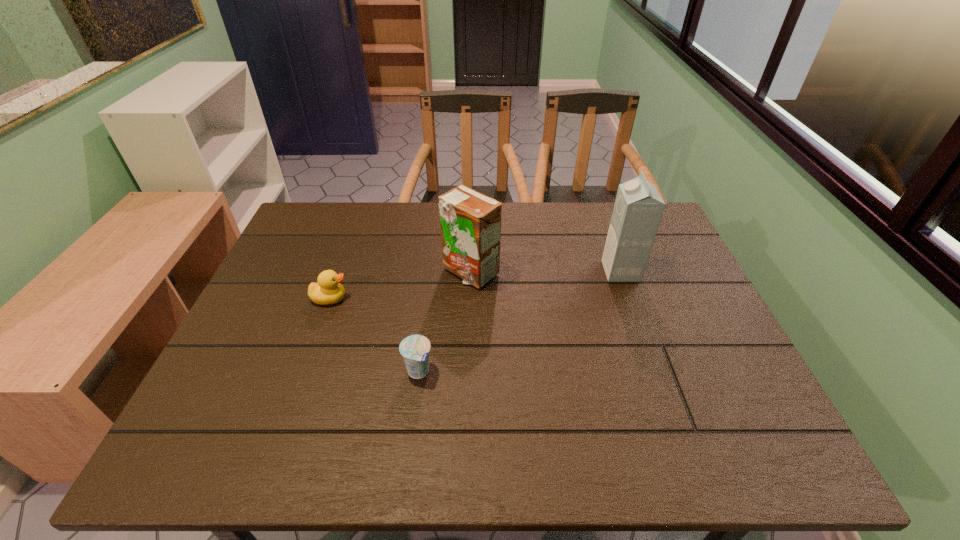
Find the location of a particular element. The image size is (960, 540). the tallest object is located at coordinates (638, 208).

You are a GUI agent. You are given a task and a screenshot of the screen. Output one action in this format:
    pyautogui.click(x=<x>, y=<y>)
    Task: Click on the taller carton
    The image size is (960, 540).
    Given the screenshot: What is the action you would take?
    pyautogui.click(x=638, y=208)

You are a GUI agent. You are given a task and a screenshot of the screen. Output one action in this format:
    pyautogui.click(x=<x>, y=<y>)
    Task: Click on the shorter carton
    The height and width of the screenshot is (540, 960).
    Given the screenshot: What is the action you would take?
    pyautogui.click(x=470, y=222)

Find the location of a particular element. This screenshot has width=960, height=540. the third shortest object is located at coordinates (470, 222).

The width and height of the screenshot is (960, 540). In order to click on the leftmost object in this screenshot , I will do `click(328, 290)`.

You are a GUI agent. You are given a task and a screenshot of the screen. Output one action in this format:
    pyautogui.click(x=<x>, y=<y>)
    Task: Click on the yogurt
    Image resolution: width=960 pixels, height=540 pixels.
    Given the screenshot: What is the action you would take?
    pyautogui.click(x=415, y=349)

Where is `vacant space situated on the front label of the tallest object`? The height and width of the screenshot is (540, 960). vacant space situated on the front label of the tallest object is located at coordinates (576, 271).

In order to click on free region located on the front label of the tallest object in this screenshot , I will do `click(510, 271)`.

Locate an element on the screen. The width and height of the screenshot is (960, 540). free region located 0.140m on the front label of the tallest object is located at coordinates [x=555, y=271].

You are a GUI agent. You are given a task and a screenshot of the screen. Output one action in this format:
    pyautogui.click(x=<x>, y=<y>)
    Task: Click on the vacant space located 0.400m on the straw side of the left carton
    The height and width of the screenshot is (540, 960).
    Given the screenshot: What is the action you would take?
    pyautogui.click(x=466, y=427)